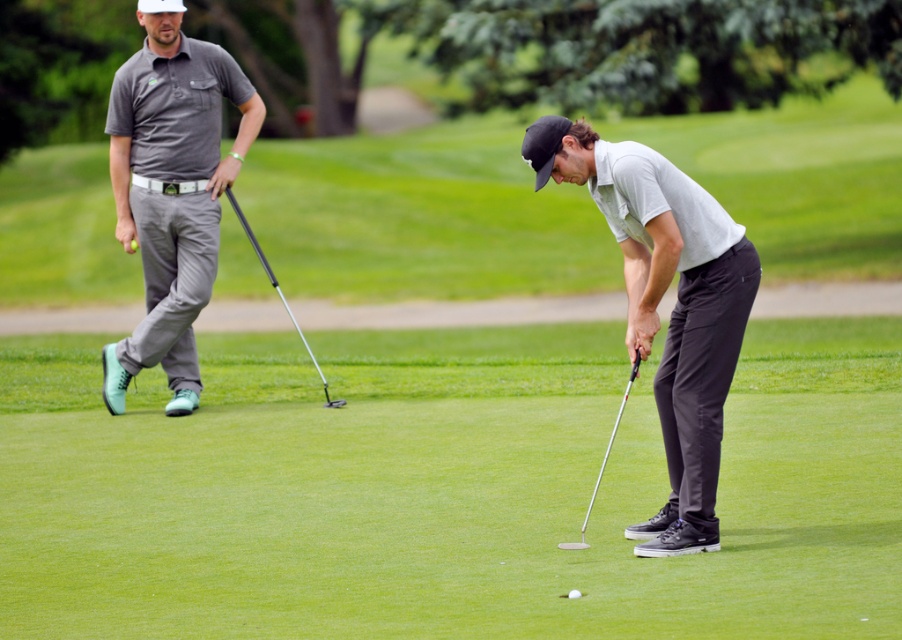
Does point (164, 360) come behind point (129, 243)?

Yes, it is behind point (129, 243).

Who is taller, matte gray polo shirt at upper left or green matte golf ball at center?

matte gray polo shirt at upper left

Is point (178, 35) behind point (129, 248)?

That is False.

Locate an element on the screen. This screenshot has width=902, height=640. matte gray polo shirt at upper left is located at coordinates (171, 189).

Is metallic silver golf club at center above white matte golf ball at center?

Indeed, metallic silver golf club at center is positioned over white matte golf ball at center.

Between point (306, 342) and point (569, 593), which one is positioned behind?

Point (306, 342)

Is point (275, 282) positioned after point (577, 592)?

That is True.

This screenshot has width=902, height=640. Find the location of `metallic silver golf club at center`. metallic silver golf club at center is located at coordinates (279, 294).

Does light gray cotton polo shirt at center appear over metallic silver putter at center?

Correct, light gray cotton polo shirt at center is located above metallic silver putter at center.

Who is shorter, light gray cotton polo shirt at center or metallic silver putter at center?

With less height is metallic silver putter at center.

Which is in front, point (623, 262) or point (620, 406)?

Point (620, 406) is in front.

The height and width of the screenshot is (640, 902). I want to click on light gray cotton polo shirt at center, so click(x=673, y=307).